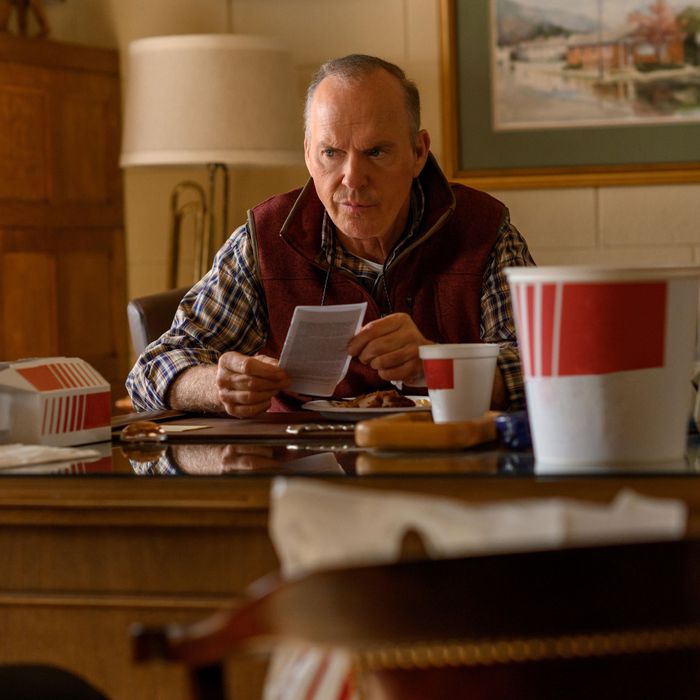
I want to click on tan lampshade top left of center, so click(206, 85).